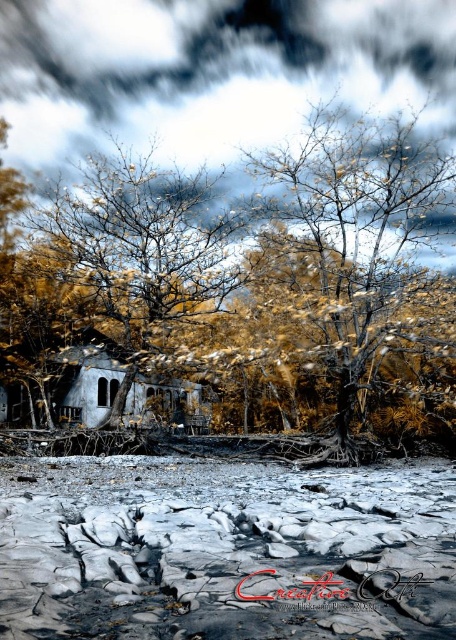
Question: Can you confirm if golden textured tree at center is wider than yellowish-brown textured tree at center?

Choices:
 (A) yes
 (B) no

Answer: (B)

Question: Which point is closer to the camera taking this photo?

Choices:
 (A) (177, 636)
 (B) (345, 124)
 (C) (206, 285)

Answer: (A)

Question: Does cracked mud puddle at lower center appear over golden textured tree at center?

Choices:
 (A) no
 (B) yes

Answer: (A)

Question: Is cracked mud puddle at lower center thinner than yellowish-brown textured tree at center?

Choices:
 (A) no
 (B) yes

Answer: (A)

Question: Which point is farther from the camera taking this photo?

Choices:
 (A) (117, 282)
 (B) (438, 570)

Answer: (A)

Question: Based on their relative distances, which object is farther from the yellowish-brown textured tree at center?

Choices:
 (A) golden textured tree at center
 (B) cracked mud puddle at lower center

Answer: (B)